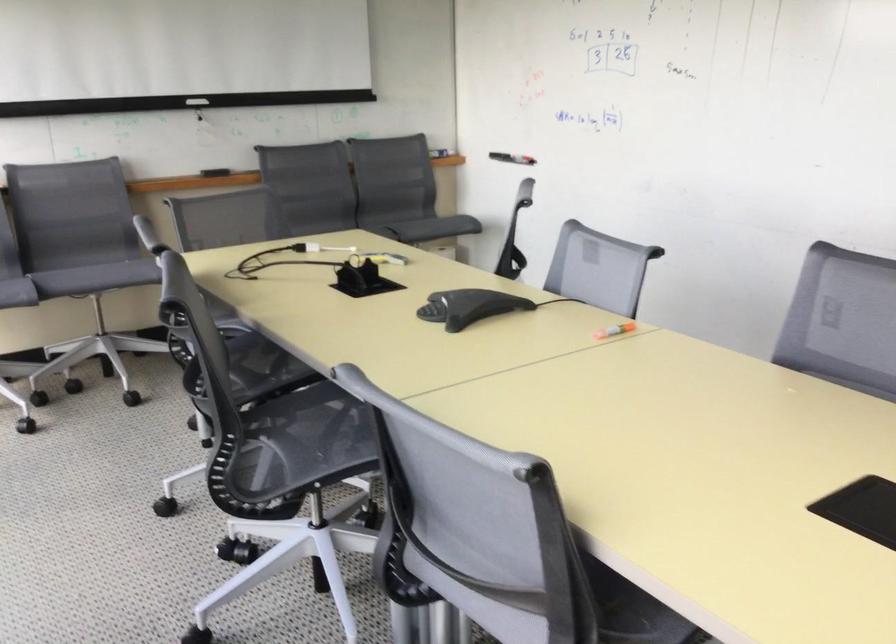
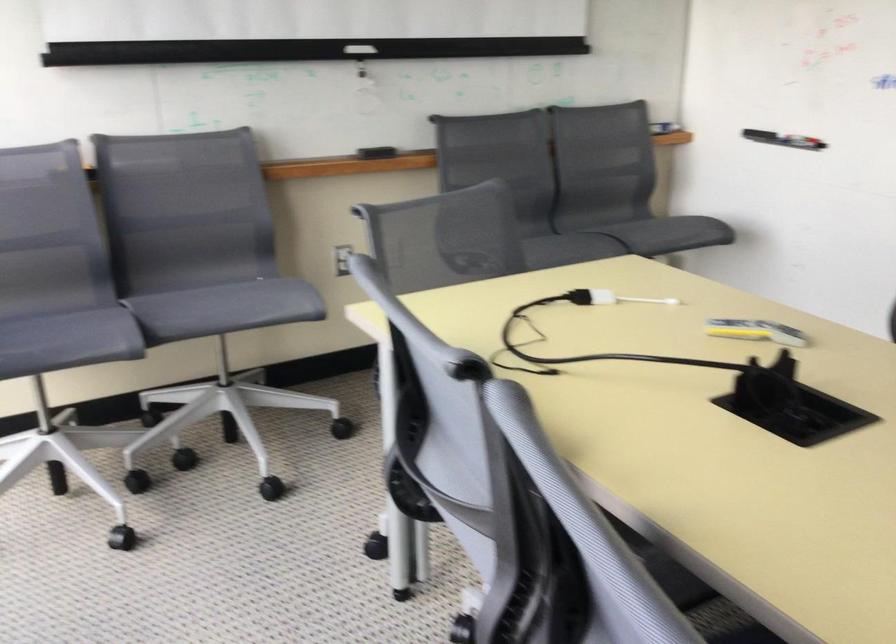
Question: I am providing you with two images of the same scene from different viewpoints. Please identify which objects are invisible in image2.

Choices:
 (A) remote control
 (B) whiteboard eraser
 (C) white cable adapter
 (D) none of these

Answer: (D)